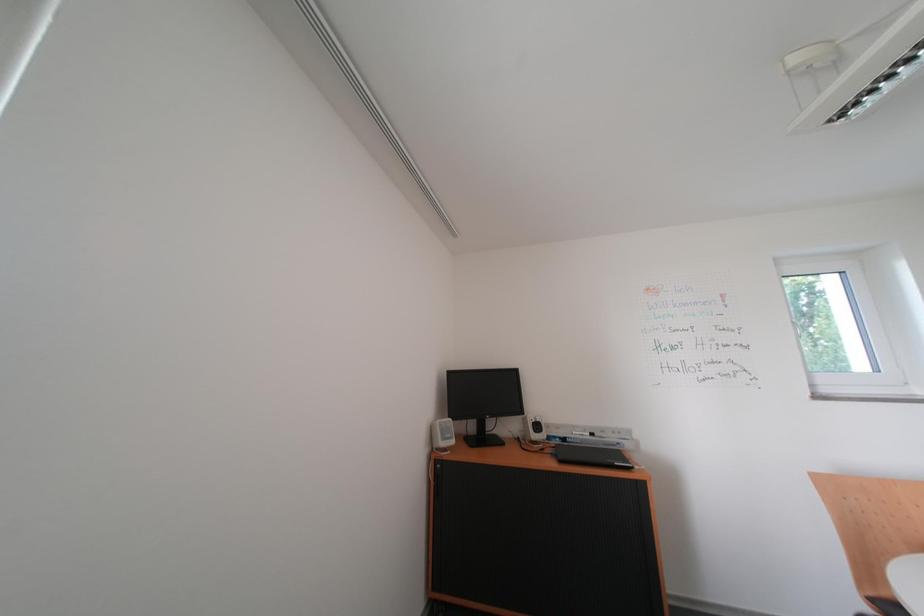
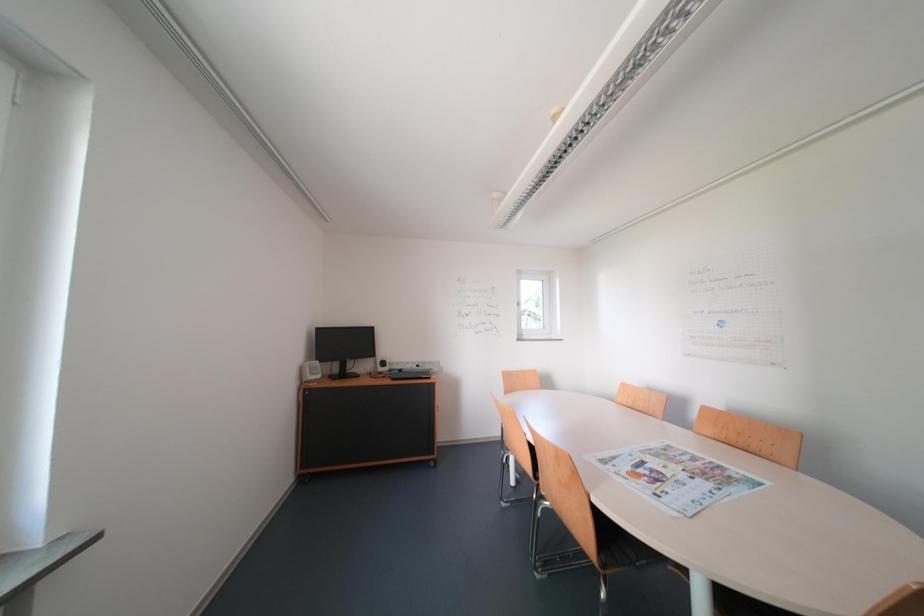
Question: The camera is either moving clockwise (left) or counter-clockwise (right) around the object. The first image is from the beginning of the video and the second image is from the end. Is the camera moving left or right when shooting the video?

Choices:
 (A) Left
 (B) Right

Answer: (A)